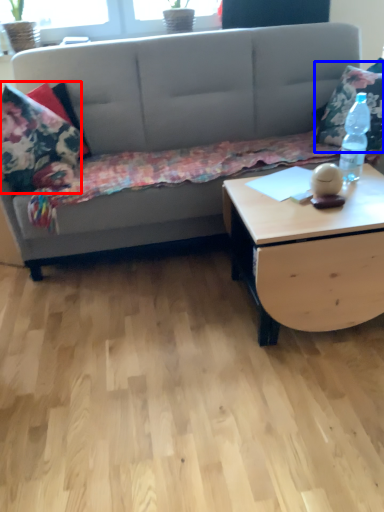
Question: Which of the following is the farthest to the observer, pillow (highlighted by a red box) or throw pillow (highlighted by a blue box)?

Choices:
 (A) pillow
 (B) throw pillow

Answer: (B)